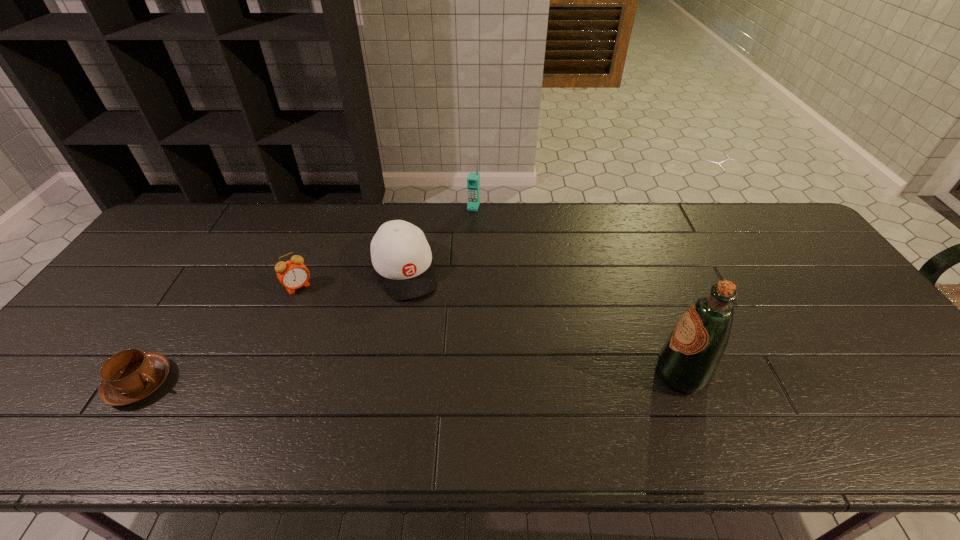
I want to click on free space on the desktop that is between the leftmost object and the rightmost object and is positioned on the face of the second object from left to right, so [x=366, y=380].

You are a GUI agent. You are given a task and a screenshot of the screen. Output one action in this format:
    pyautogui.click(x=<x>, y=<y>)
    Task: Click on the vacant spot on the desktop that is between the leftmost object and the olive oil and is positioned on the front-facing side of the baseball cap
    
    Given the screenshot: What is the action you would take?
    pyautogui.click(x=451, y=378)

Identify the location of vacant space on the desktop that is between the leftmost object and the rightmost object and is positioned on the keypad of the farthest object. (412, 379).